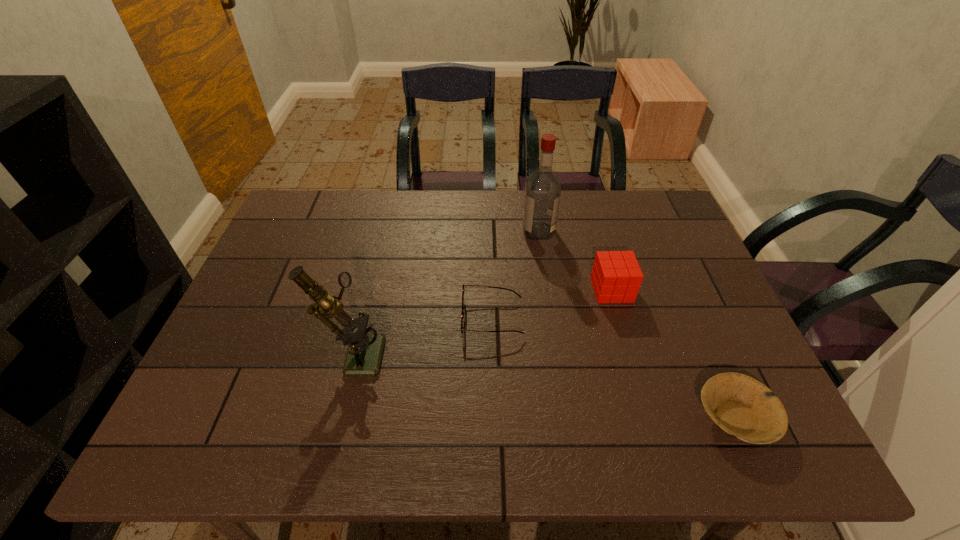
You are a GUI agent. You are given a task and a screenshot of the screen. Output one action in this format:
    pyautogui.click(x=<x>, y=<y>)
    Task: Click on the free spot between the spectacles and the nearest object
    The image size is (960, 540).
    Given the screenshot: What is the action you would take?
    pyautogui.click(x=613, y=368)

This screenshot has width=960, height=540. I want to click on vacant space in between the leftmost object and the rightmost object, so click(x=544, y=384).

Locate an element on the screen. vacant space that's between the leftmost object and the nearest object is located at coordinates 544,384.

Identify the location of vacant region between the fourth object from right to left and the third object from right to left. The height and width of the screenshot is (540, 960). (516, 274).

This screenshot has width=960, height=540. In order to click on vacant point located between the bowl and the microscope in this screenshot , I will do `click(544, 384)`.

Identify the location of free spot between the third object from left to right and the microscope. The image size is (960, 540). (446, 292).

Point out which object is positioned as the second nearest to the rightmost object. Please provide its 2D coordinates. Your answer should be formatted as a tuple, i.e. [(x, y)], where the tuple contains the x and y coordinates of a point satisfying the conditions above.

[(462, 313)]

Where is `object that is the closest to the third object from left to right`? Image resolution: width=960 pixels, height=540 pixels. object that is the closest to the third object from left to right is located at coordinates (616, 277).

The width and height of the screenshot is (960, 540). In order to click on free region that satisfies the following two spatial constraints: 1. on the back side of the nearest object; 2. on the face of the fourth object from right to left in this screenshot , I will do `click(692, 318)`.

In order to click on blank area in the image that satisfies the following two spatial constraints: 1. on the face of the spectacles; 2. on the back side of the rightmost object in this screenshot , I will do `click(495, 417)`.